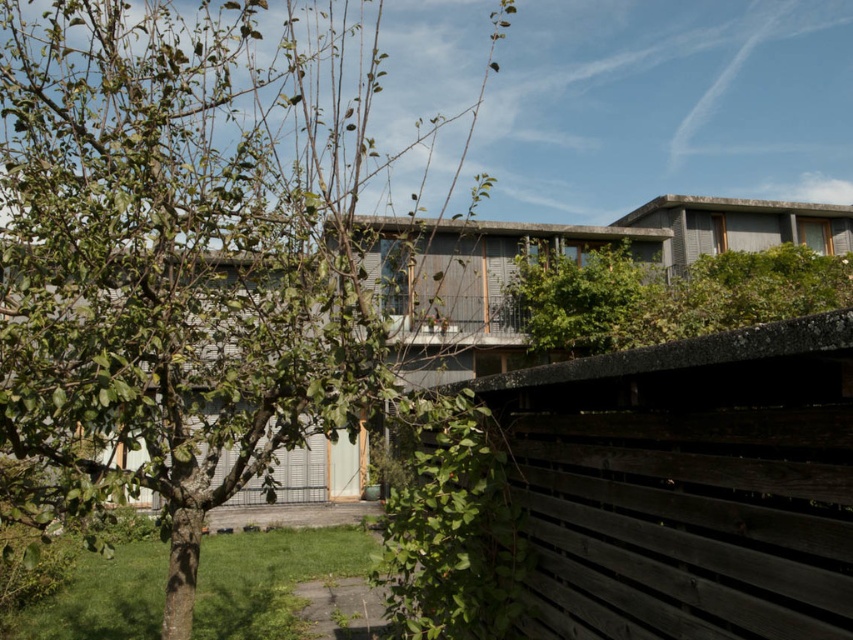
Is green leafy tree at center above dark gray wooden fence at center?

Yes, green leafy tree at center is above dark gray wooden fence at center.

Is point (51, 336) positioned in front of point (607, 388)?

No, (51, 336) is further to viewer.

Is point (146, 72) positioned in front of point (634, 348)?

No, it is behind (634, 348).

The width and height of the screenshot is (853, 640). I want to click on green leafy tree at center, so click(x=178, y=253).